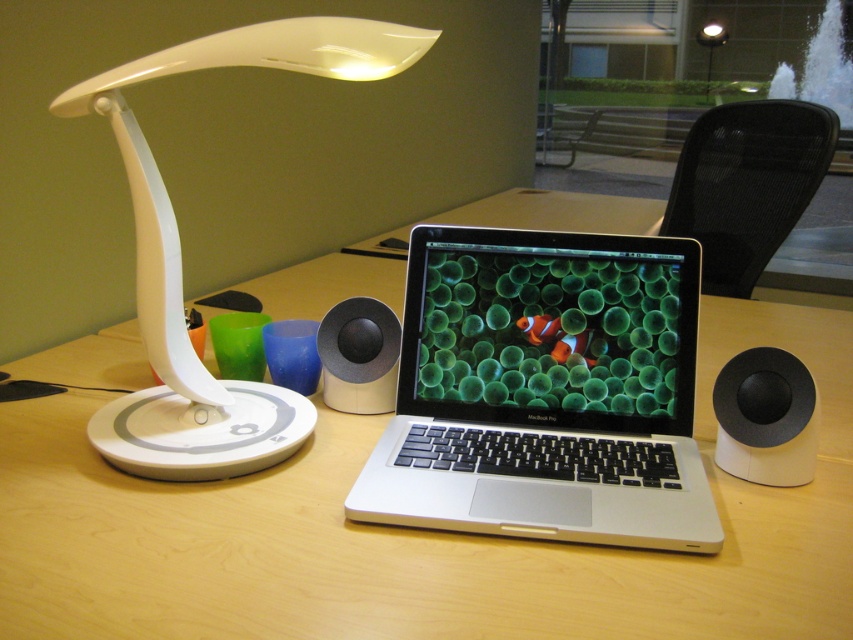
You are a delivery person who needs to place a package on the desk without moving any existing items. The package is 38 inches long. Can you fit it between the white matte speaker at right and the edge of the desk closest to you?

The white matte speaker at right is 37.45 inches away from the viewer. Since the package is 38 inches long, it is slightly longer than the available space, so it won

You are setting up a new wireless speaker on your desk. The existing white matte speaker at right is placed at coordinates 0.653, 0.898. If you want to place the new speaker exactly 0.1 units to the right of the existing one, what would be the new coordinates?

The new speaker should be placed at coordinates (764, 481).